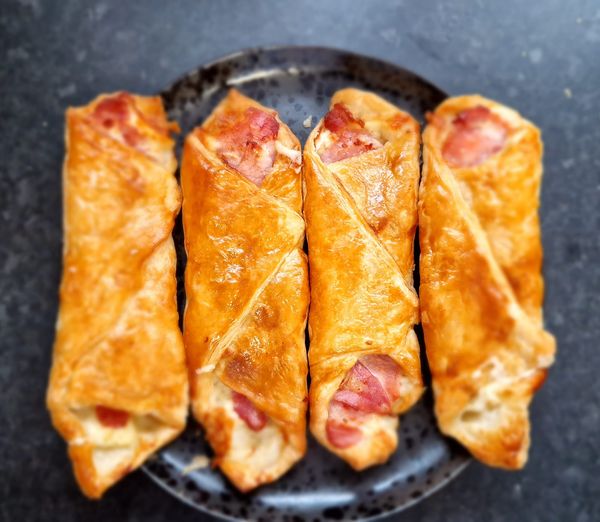
Locate an element on the screen. The image size is (600, 522). light reflecting on plate edge is located at coordinates (244, 76).